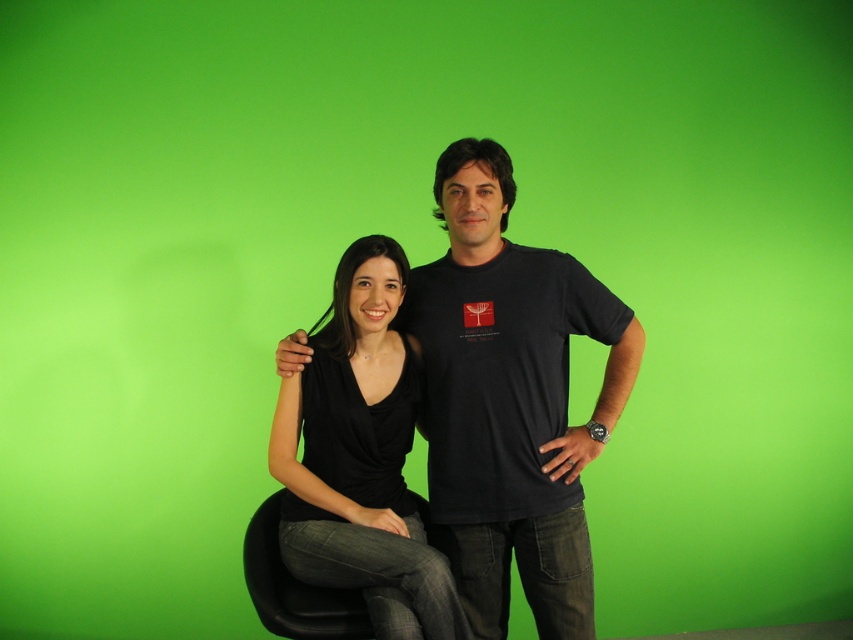
Question: Is black matte t-shirt at center further to the viewer compared to black matte shirt at center?

Choices:
 (A) no
 (B) yes

Answer: (B)

Question: In this image, where is black matte t-shirt at center located relative to black matte shirt at center?

Choices:
 (A) right
 (B) left

Answer: (A)

Question: Is black matte t-shirt at center thinner than black matte shirt at center?

Choices:
 (A) no
 (B) yes

Answer: (A)

Question: Which point is farther to the camera?

Choices:
 (A) black matte t-shirt at center
 (B) black matte shirt at center

Answer: (A)

Question: Which point is farther to the camera?

Choices:
 (A) (383, 365)
 (B) (450, 376)

Answer: (A)